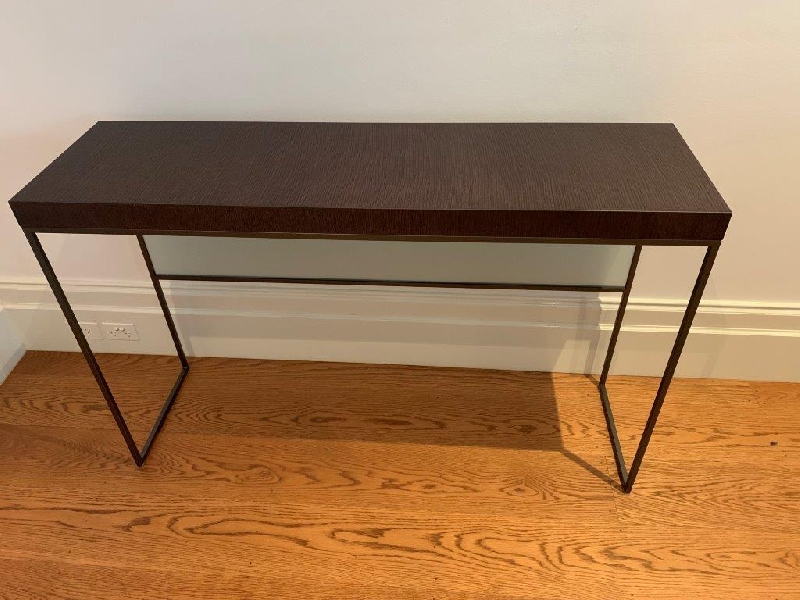
Where is `brown shiny floor`? The width and height of the screenshot is (800, 600). brown shiny floor is located at coordinates (270, 496).